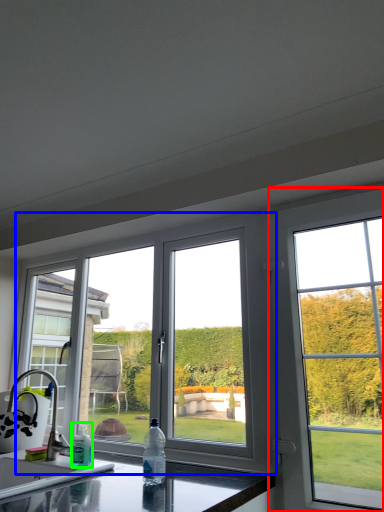
Question: Estimate the real-world distances between objects in this image. Which object is farther from window (highlighted by a red box), window (highlighted by a blue box) or bottle (highlighted by a green box)?

Choices:
 (A) window
 (B) bottle

Answer: (B)